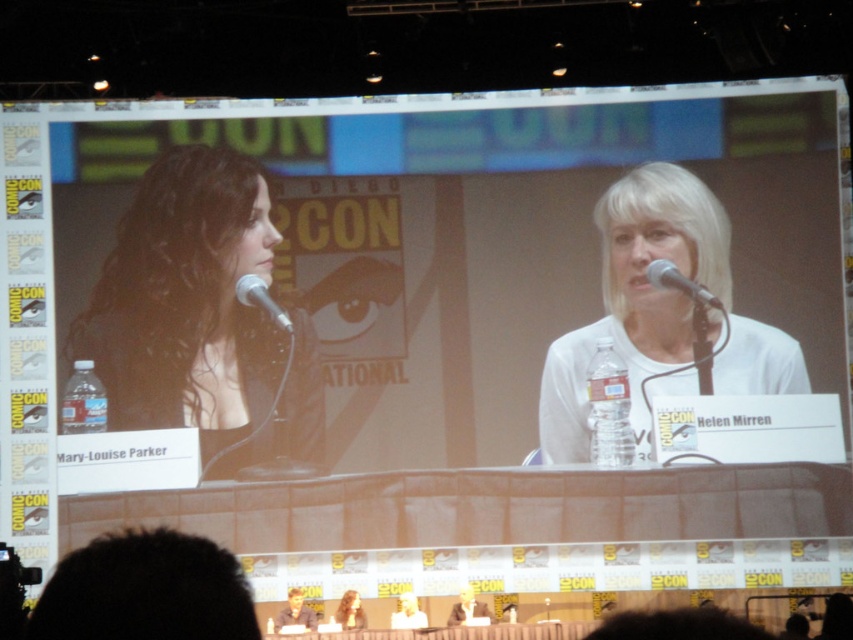
Is black matte hair at left smaller than matte black microphone at upper center?

Incorrect, black matte hair at left is not smaller in size than matte black microphone at upper center.

Which is in front, point (196, 371) or point (706, 300)?

Positioned in front is point (196, 371).

Is point (308, 435) positioned before point (689, 292)?

Yes, point (308, 435) is closer to viewer.

What are the coordinates of `black matte hair at left` in the screenshot? It's located at click(184, 301).

Which is behind, point (461, 612) or point (405, 616)?

Point (461, 612)

Can you confirm if smooth white shirt at center is shorter than smooth white shirt at lower center?

No, smooth white shirt at center is not shorter than smooth white shirt at lower center.

Who is more forward, (459, 611) or (415, 600)?

Point (415, 600)

Identify the location of smooth white shirt at center. (467, 608).

Is matte black microphone at upper center smaller than metallic silver microphone at left?

Yes, matte black microphone at upper center is smaller than metallic silver microphone at left.

From the picture: Is matte black microphone at upper center shorter than metallic silver microphone at left?

Indeed, matte black microphone at upper center has a lesser height compared to metallic silver microphone at left.

The image size is (853, 640). I want to click on matte black microphone at upper center, so click(x=679, y=282).